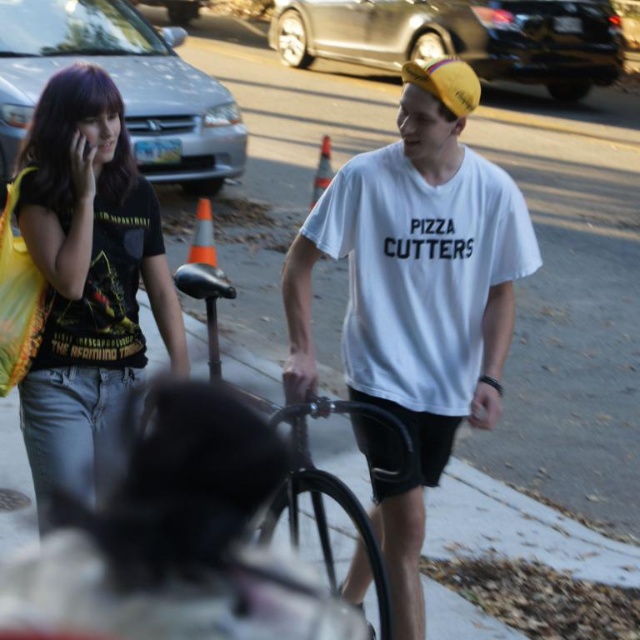
You are a delivery person who needs to deliver a package to the white cotton tshirt at center. You are currently standing at the point marked by the coordinate point (x=417, y=296). Is the white cotton tshirt at center in front of or behind you?

The point marked by the coordinate point (x=417, y=296) indicates the location of the white cotton tshirt at center, so the white cotton tshirt at center is exactly where you are standing. Therefore, it is neither in front nor behind you.